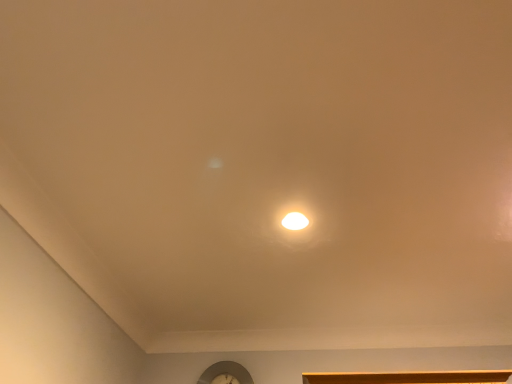
Question: From the image's perspective, is white glossy light fixture at center above or below metallic silver clock at lower center?

Choices:
 (A) above
 (B) below

Answer: (A)

Question: Is point (287, 228) closer or farther from the camera than point (199, 380)?

Choices:
 (A) farther
 (B) closer

Answer: (B)

Question: Looking at their shapes, would you say white glossy light fixture at center is wider or thinner than metallic silver clock at lower center?

Choices:
 (A) wide
 (B) thin

Answer: (A)

Question: In terms of size, does metallic silver clock at lower center appear bigger or smaller than white glossy light fixture at center?

Choices:
 (A) big
 (B) small

Answer: (A)

Question: Is metallic silver clock at lower center inside the boundaries of white glossy light fixture at center, or outside?

Choices:
 (A) inside
 (B) outside

Answer: (B)

Question: In the image, is metallic silver clock at lower center positioned in front of or behind white glossy light fixture at center?

Choices:
 (A) front
 (B) behind

Answer: (B)

Question: From a real-world perspective, is metallic silver clock at lower center physically located above or below white glossy light fixture at center?

Choices:
 (A) above
 (B) below

Answer: (B)